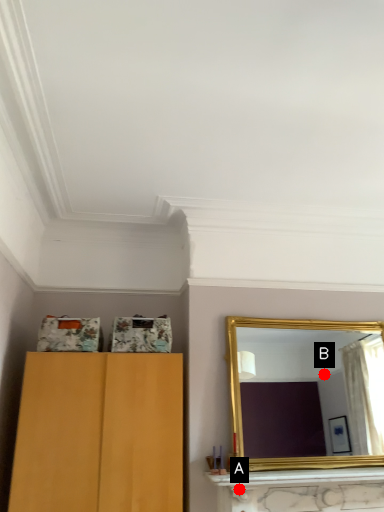
Question: Two points are circled on the image, labeled by A and B beside each circle. Which point is further to the camera?

Choices:
 (A) A is further
 (B) B is further

Answer: (B)